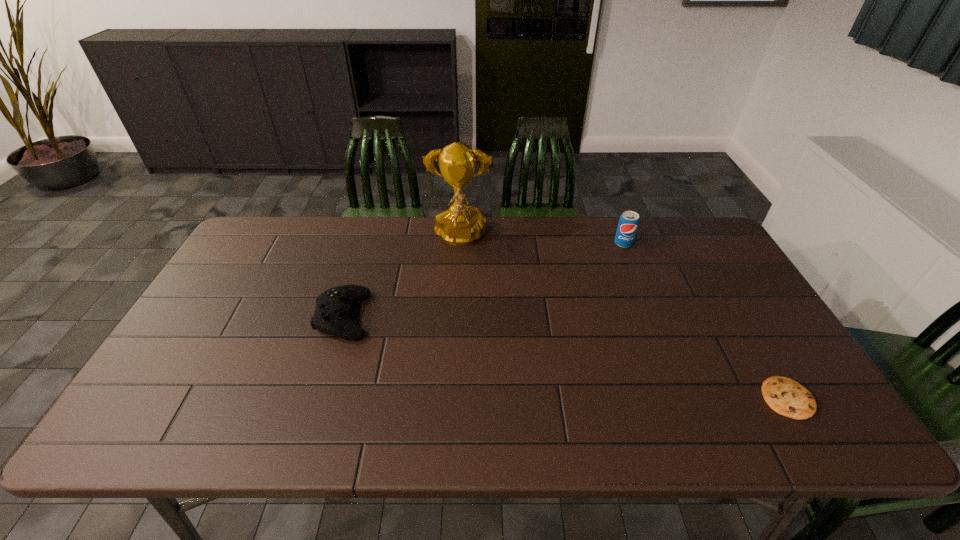
Where is `blank space located 0.230m on the back of the leftmost object`? This screenshot has height=540, width=960. blank space located 0.230m on the back of the leftmost object is located at coordinates (366, 244).

I want to click on vacant position located 0.250m on the left of the nearest object, so click(x=655, y=398).

Where is `award that is positioned at the far edge`? Image resolution: width=960 pixels, height=540 pixels. award that is positioned at the far edge is located at coordinates (459, 225).

This screenshot has height=540, width=960. I want to click on soda can that is at the far edge, so click(628, 223).

Locate an element on the screen. object located in the near edge section of the desktop is located at coordinates (787, 397).

Find the location of a particular element. The image size is (960, 540). object that is positioned at the right edge is located at coordinates (787, 397).

Find the location of a particular element. object at the near right corner is located at coordinates (787, 397).

The image size is (960, 540). What are the coordinates of `vacant region at the far edge of the desktop` in the screenshot? It's located at (643, 242).

Locate an element on the screen. vacant space at the near edge of the desktop is located at coordinates (219, 427).

In the image, there is a desktop. Find the location of `vacant space at the far right corner`. vacant space at the far right corner is located at coordinates (682, 251).